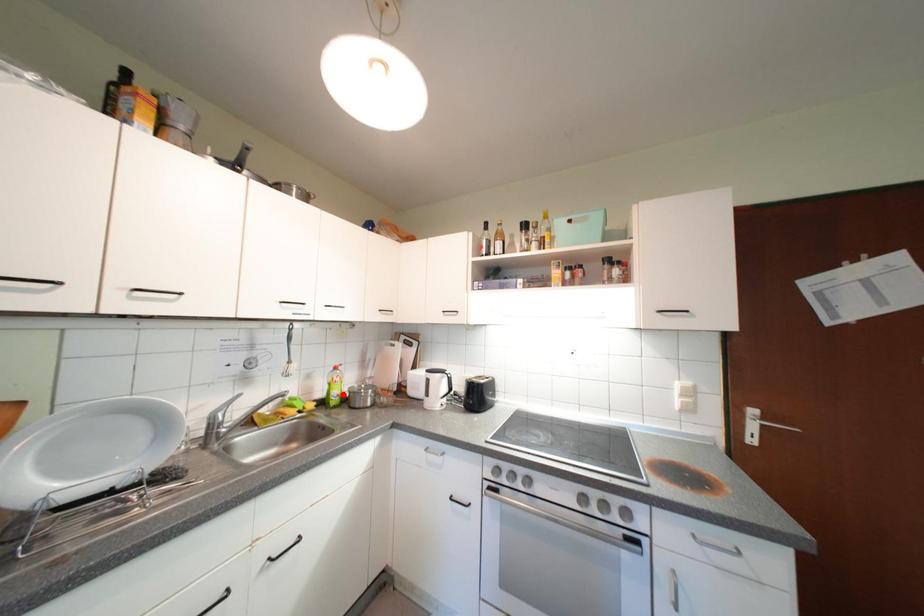
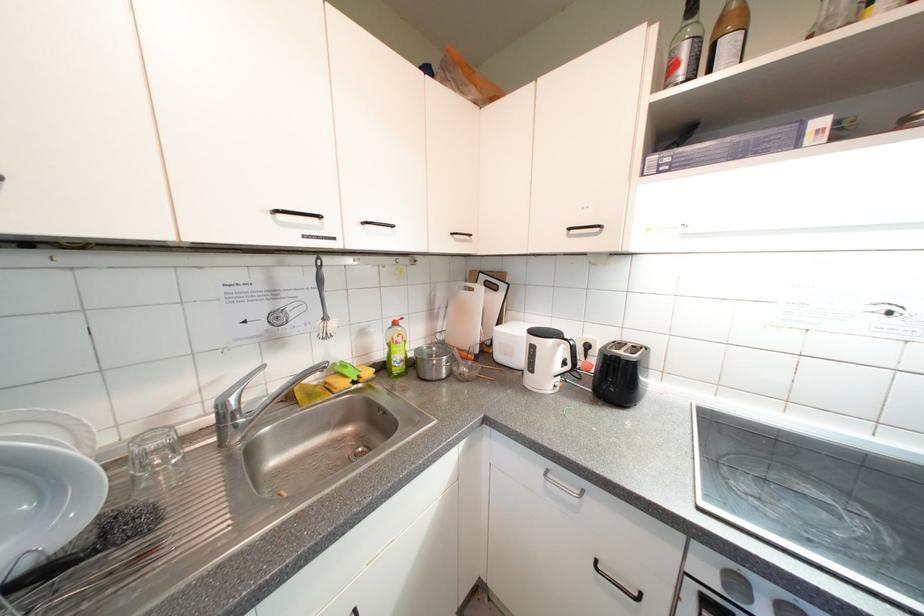
Locate, in the second image, the point that corresponds to the highlighted location in the first image.

(406, 358)